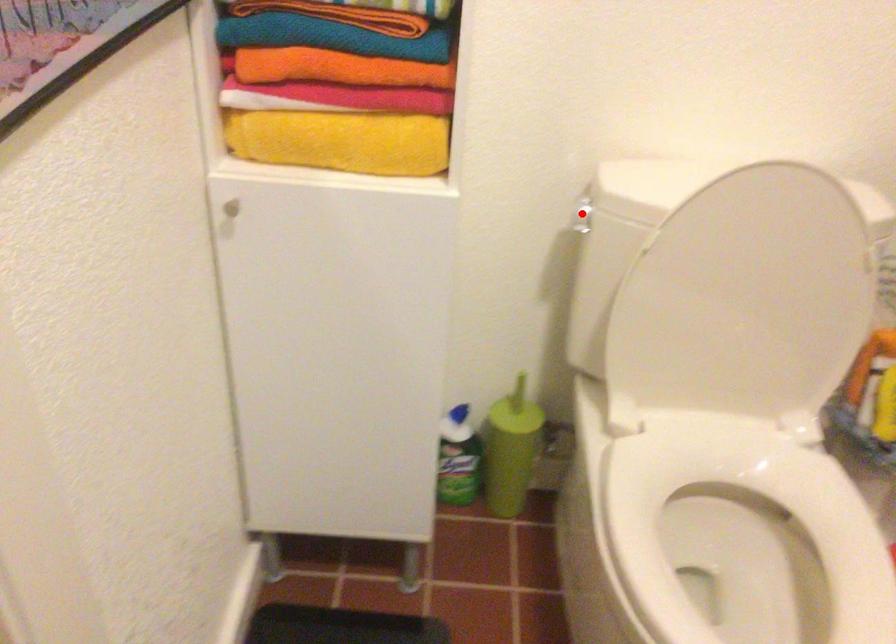
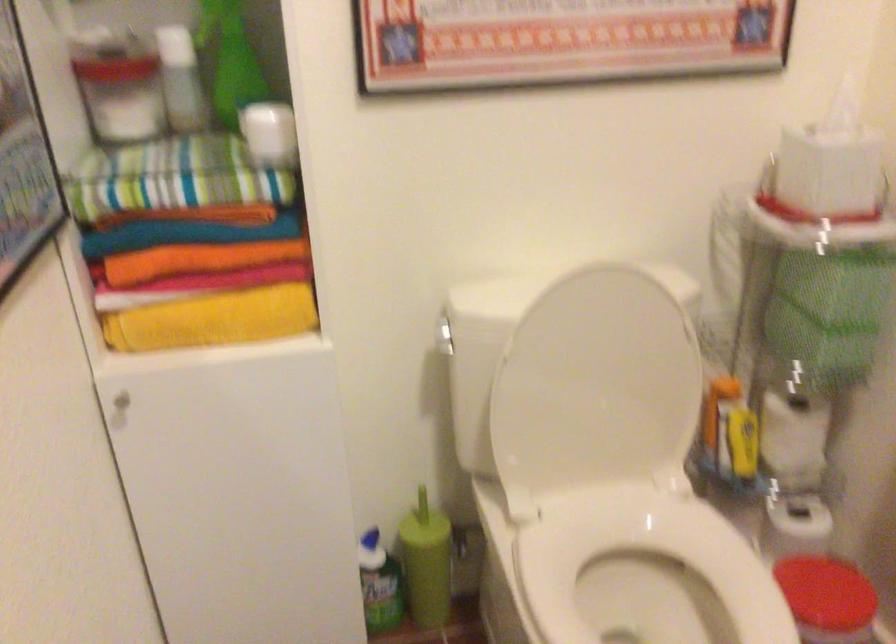
Locate, in the second image, the point that corresponds to the highlighted location in the first image.

(444, 336)